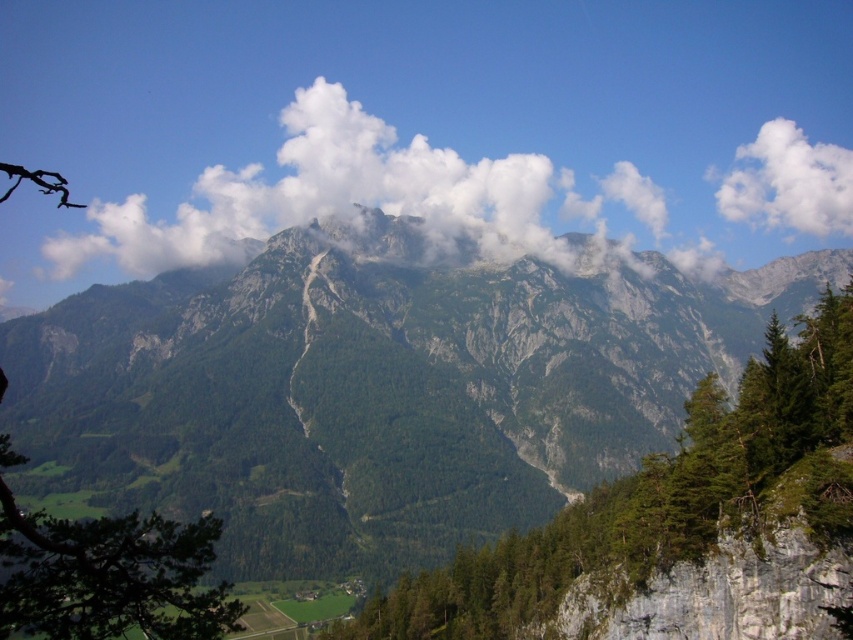
You are a hiker planning to take a photo of the green rough rock at center and the white fluffy cloud at upper center. Which object will appear closer to the camera in the photo?

The green rough rock at center will appear closer to the camera because it is in front of the white fluffy cloud at upper center.

You are standing at the base of the mountain and looking up at the two points marked on the mountain slope. Which point is closer to you, point (434, 584) or point (511, 189)?

Point (434, 584) is closer to the viewer than point (511, 189).